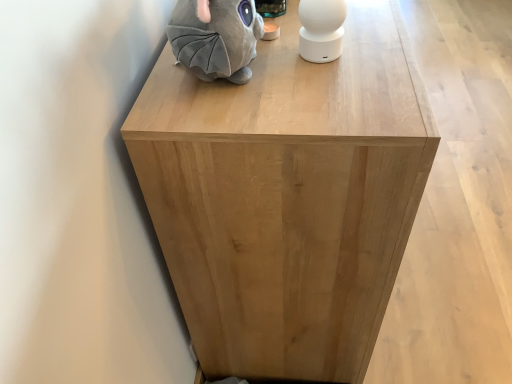
Identify the location of free region on the left part of white matte speaker at upper center, the second toy positioned from the left. (247, 77).